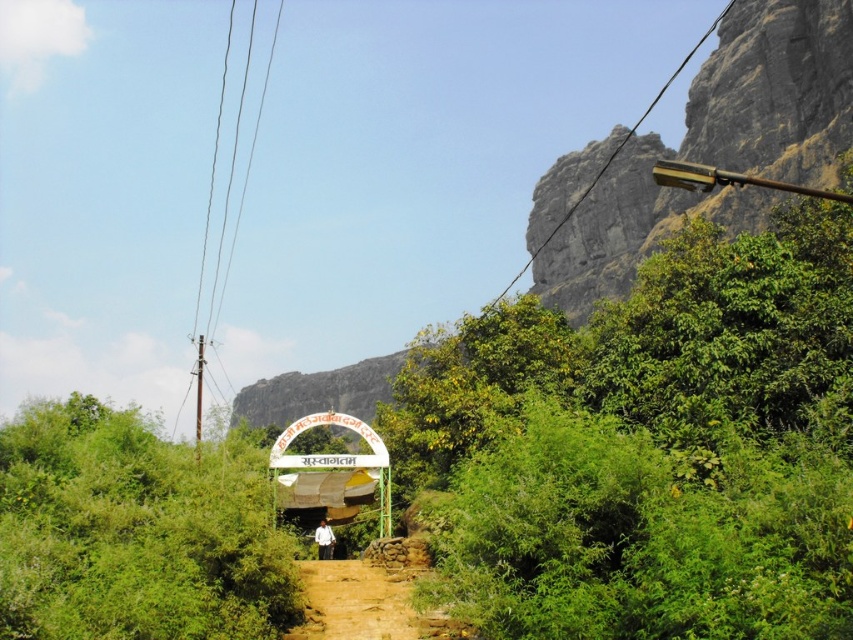
Can you confirm if green leafy bush at center is smaller than gray rock formation at upper center?

Indeed, green leafy bush at center has a smaller size compared to gray rock formation at upper center.

Between green leafy bush at center and gray rock formation at upper center, which one appears on the right side from the viewer's perspective?

Positioned to the right is gray rock formation at upper center.

Does point (247, 468) come farther from viewer compared to point (751, 70)?

No.

At what (x,y) coordinates should I click in order to perform the action: click on green leafy bush at center. Please return your answer as a coordinate pair (x, y). This screenshot has width=853, height=640. Looking at the image, I should click on (134, 532).

Is green leafy bush at center taller than brown dirt track at lower center?

Yes.

The image size is (853, 640). What are the coordinates of `green leafy bush at center` in the screenshot? It's located at (134, 532).

At what (x,y) coordinates should I click in order to perform the action: click on green leafy bush at center. Please return your answer as a coordinate pair (x, y). This screenshot has height=640, width=853. Looking at the image, I should click on (134, 532).

Where is `green leafy bush at center`? green leafy bush at center is located at coordinates (134, 532).

Between point (665, 244) and point (44, 632), which one is positioned in front?

Point (44, 632)

Between green leafy bush at upper right and green leafy bush at center, which one appears on the right side from the viewer's perspective?

green leafy bush at upper right is more to the right.

Which is in front, point (708, 552) or point (200, 609)?

Point (708, 552)

I want to click on green leafy bush at upper right, so [x=648, y=445].